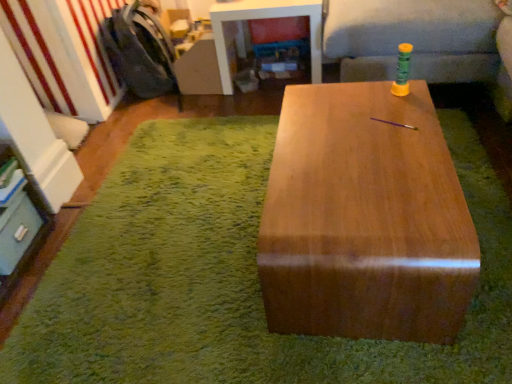
Find the location of `blank space to the left of satin wood table at center, acting as the 2th table starting from the top`. blank space to the left of satin wood table at center, acting as the 2th table starting from the top is located at coordinates (178, 247).